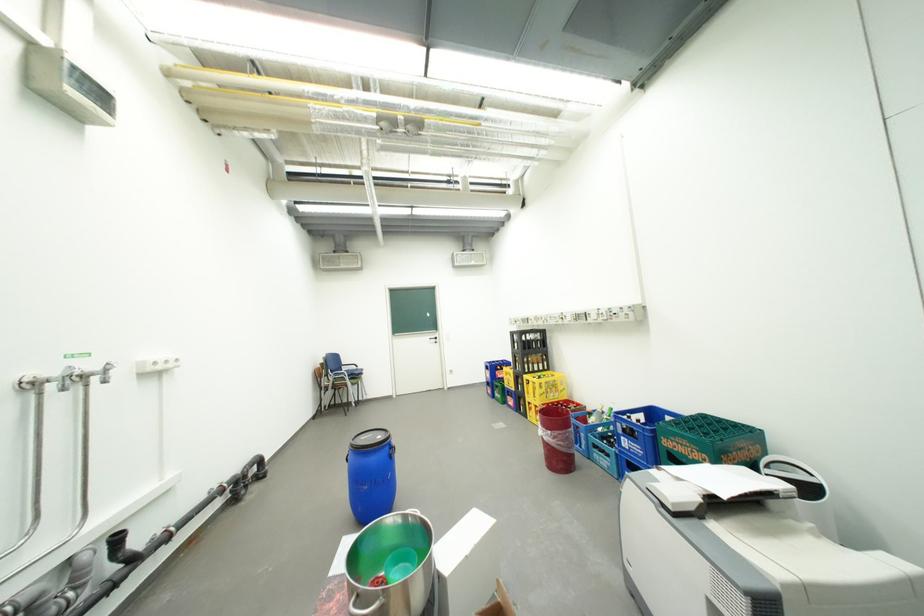
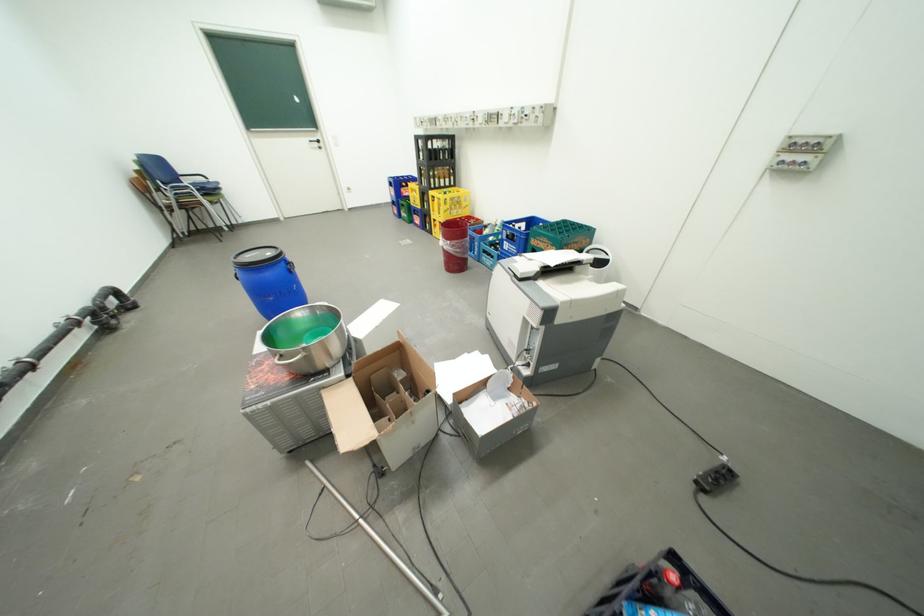
Find the pixel in the second image that matches point (560, 434) in the first image.

(459, 243)